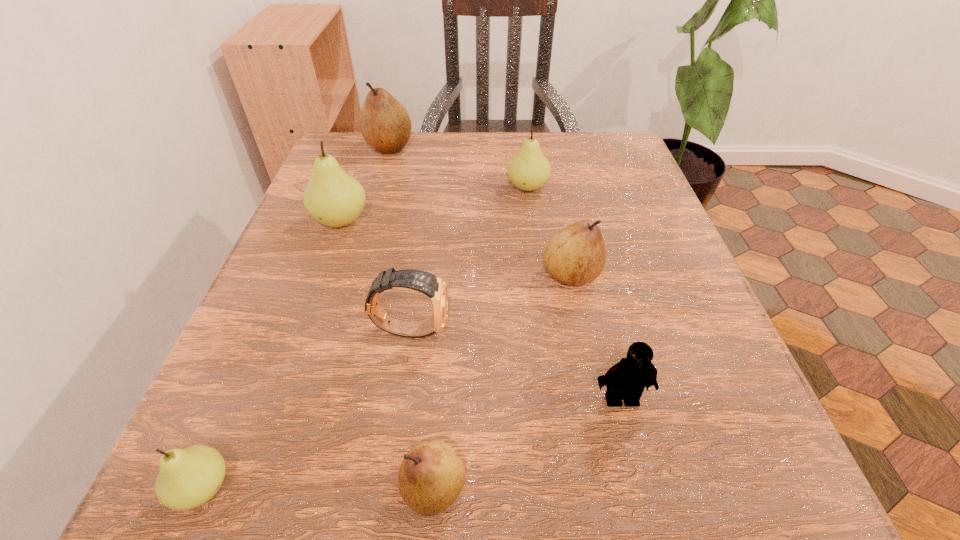
Locate an element on the screen. The width and height of the screenshot is (960, 540). vacant area at the far left corner of the desktop is located at coordinates (366, 151).

At what (x,y) coordinates should I click in order to perform the action: click on free location at the near left corner of the desktop. Please return your answer as a coordinate pair (x, y). The width and height of the screenshot is (960, 540). Looking at the image, I should click on (251, 451).

Find the location of a particular element. This screenshot has width=960, height=540. blank space at the far right corner of the desktop is located at coordinates (609, 137).

This screenshot has height=540, width=960. In the image, there is a desktop. Identify the location of vacant space at the near right corner. (700, 515).

Find the location of `unoccupied position between the nearest brown pear and the Lego`. unoccupied position between the nearest brown pear and the Lego is located at coordinates (528, 443).

This screenshot has height=540, width=960. I want to click on vacant space in between the second smallest brown pear and the second brown pear from right to left, so click(503, 381).

What are the coordinates of `unoccupied area between the black Lego and the fifth nearest pear` in the screenshot? It's located at (574, 293).

The image size is (960, 540). I want to click on vacant region between the farthest brown pear and the sixth nearest object, so click(x=365, y=184).

I want to click on free space between the rightmost brown pear and the farthest pear, so click(x=480, y=211).

Locate an element on the screen. This screenshot has width=960, height=540. empty space between the nearest green pear and the Lego is located at coordinates (413, 443).